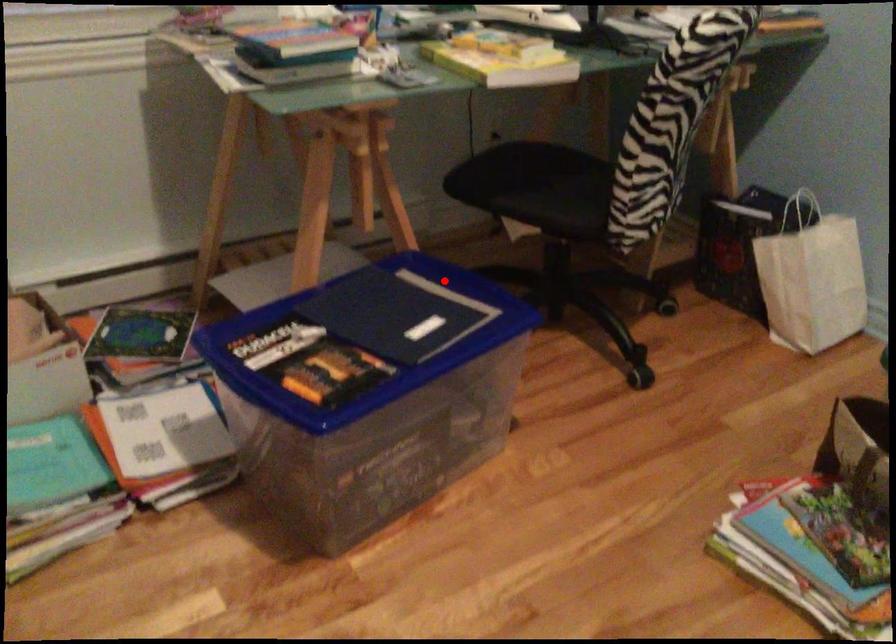
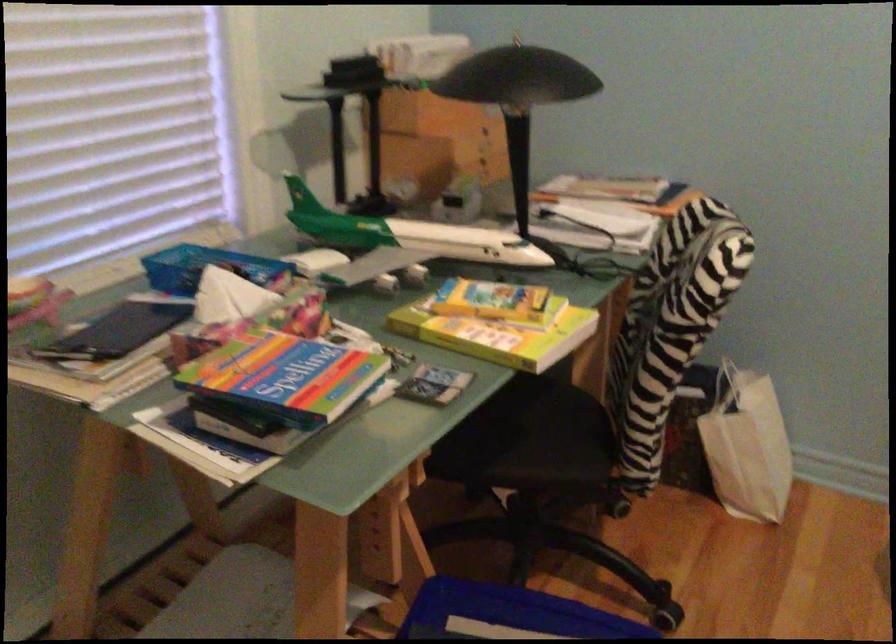
Question: I am providing you with two images of the same scene from different viewpoints. Given a red point in image1, look at the same physical point in image2. Is it:

Choices:
 (A) Closer to the viewpoint
 (B) Farther from the viewpoint

Answer: (A)